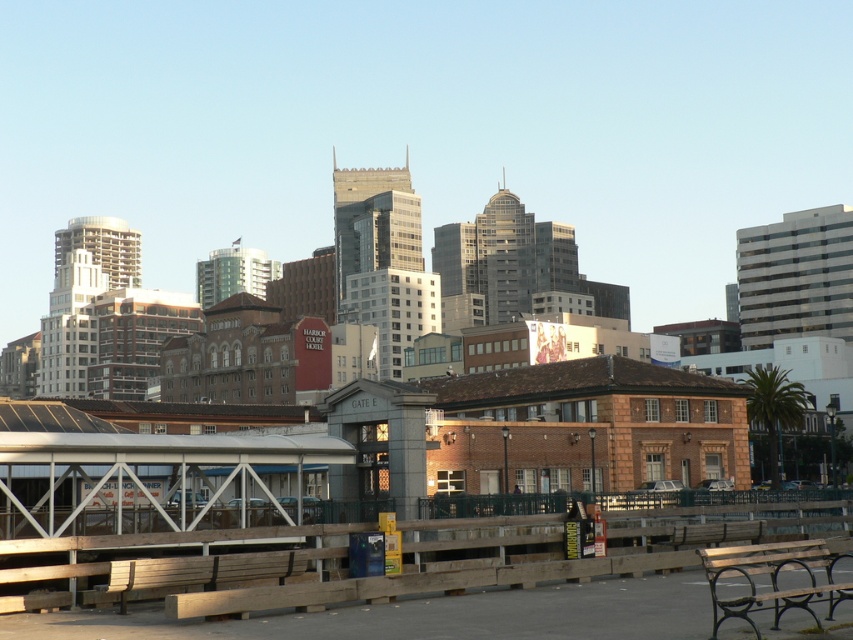
Is wooden bench at lower right to the left of wooden bench at lower left from the viewer's perspective?

No, wooden bench at lower right is not to the left of wooden bench at lower left.

Does wooden bench at lower right appear on the right side of wooden bench at lower left?

Correct, you'll find wooden bench at lower right to the right of wooden bench at lower left.

The height and width of the screenshot is (640, 853). I want to click on wooden bench at lower right, so click(772, 579).